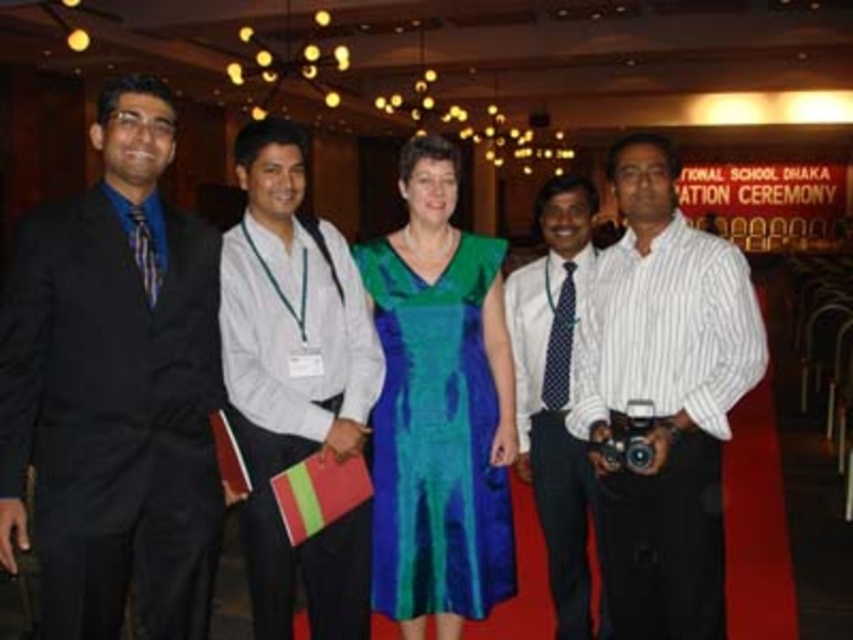
Is white striped shirt at center taller than shiny satin dress at center?

Incorrect, white striped shirt at center's height is not larger of shiny satin dress at center's.

Between white striped shirt at center and shiny satin dress at center, which one has more height?

shiny satin dress at center is taller.

In order to click on white striped shirt at center in this screenshot , I will do `click(663, 396)`.

Locate an element on the screen. The image size is (853, 640). white striped shirt at center is located at coordinates (663, 396).

Does shiny satin dress at center appear over white dotted tie at center?

Indeed, shiny satin dress at center is positioned over white dotted tie at center.

Does point (370, 268) come behind point (567, 515)?

No, it is in front of (567, 515).

Does point (413, 540) come farther from viewer compared to point (554, 596)?

No, it is not.

Where is `shiny satin dress at center`? The height and width of the screenshot is (640, 853). shiny satin dress at center is located at coordinates (439, 406).

Is matte black suit at left to the right of white cotton shirt at center from the viewer's perspective?

No, matte black suit at left is not to the right of white cotton shirt at center.

Is matte black suit at left positioned at the back of white cotton shirt at center?

No, matte black suit at left is closer to the viewer.

Is point (154, 83) closer to viewer compared to point (265, 397)?

Yes, it is.

I want to click on matte black suit at left, so click(x=114, y=388).